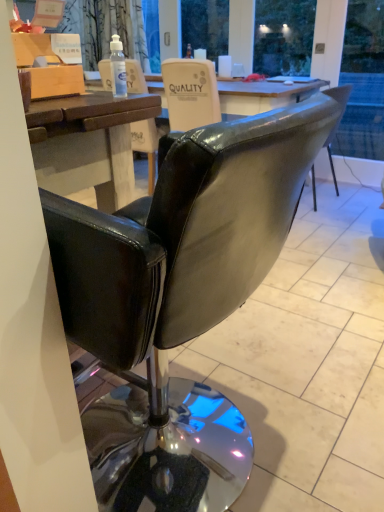
Find the location of a particular element. Image resolution: width=384 pixels, height=512 pixels. black leather chair at center is located at coordinates (179, 301).

Does black leather chair at center turn towards transparent plastic bottle at upper center?

No, black leather chair at center is not oriented towards transparent plastic bottle at upper center.

Can you tell me how much black leather chair at center and transparent plastic bottle at upper center differ in facing direction?

The angle between the facing direction of black leather chair at center and the facing direction of transparent plastic bottle at upper center is 0.00741 degrees.

From the image's perspective, does black leather chair at center appear higher than transparent plastic bottle at upper center?

Incorrect, from the image's perspective, black leather chair at center is lower than transparent plastic bottle at upper center.

Is point (147, 366) positioned after point (119, 65)?

Yes, point (147, 366) is farther from viewer.

Does transparent plastic bottle at upper center turn towards black leather chair at center?

No, transparent plastic bottle at upper center does not turn towards black leather chair at center.

Considering the sizes of objects transparent plastic bottle at upper center and black leather chair at center in the image provided, who is smaller, transparent plastic bottle at upper center or black leather chair at center?

transparent plastic bottle at upper center.

Which object is wider, transparent plastic bottle at upper center or black leather chair at center?

black leather chair at center.

Is point (120, 73) closer to camera compared to point (226, 184)?

No, it is not.

Could you tell me if transparent plastic bottle at upper center is facing wooden box at upper left?

No, transparent plastic bottle at upper center is not oriented towards wooden box at upper left.

Considering the relative positions of transparent plastic bottle at upper center and wooden box at upper left in the image provided, is transparent plastic bottle at upper center behind wooden box at upper left?

Yes, it is behind wooden box at upper left.

From a real-world perspective, between transparent plastic bottle at upper center and wooden box at upper left, who is vertically higher?

In real-world perspective, wooden box at upper left is above.

Based on the photo, would you say transparent plastic bottle at upper center is a long distance from wooden box at upper left?

No, there isn't a large distance between transparent plastic bottle at upper center and wooden box at upper left.

Can wooden box at upper left be found inside black leather chair at center?

No, wooden box at upper left is not inside black leather chair at center.

Is black leather chair at center wider than wooden box at upper left?

Indeed, black leather chair at center has a greater width compared to wooden box at upper left.

Looking at the image, does black leather chair at center seem bigger or smaller compared to wooden box at upper left?

In the image, black leather chair at center appears to be larger than wooden box at upper left.

Is wooden box at upper left not inside black leather chair at center?

Yes, wooden box at upper left is not within black leather chair at center.

Consider the image. Does wooden box at upper left appear on the left side of black leather chair at center?

Yes.

Can you tell me how much wooden box at upper left and black leather chair at center differ in facing direction?

The angular difference between wooden box at upper left and black leather chair at center is 0.001 degrees.

Who is shorter, wooden box at upper left or black leather chair at center?

With less height is wooden box at upper left.

Between wooden box at upper left and transparent plastic bottle at upper center, which one has larger size?

Bigger between the two is wooden box at upper left.

Between wooden box at upper left and transparent plastic bottle at upper center, which one has more height?

wooden box at upper left.

In terms of width, does wooden box at upper left look wider or thinner when compared to transparent plastic bottle at upper center?

Clearly, wooden box at upper left has more width compared to transparent plastic bottle at upper center.

From the image's perspective, between wooden box at upper left and transparent plastic bottle at upper center, which one is located above?

wooden box at upper left.

Locate an element on the screen. This screenshot has height=512, width=384. bottle on the left of black leather chair at center is located at coordinates (118, 67).

The height and width of the screenshot is (512, 384). What are the coordinates of `chair below the transparent plastic bottle at upper center (from a real-world perspective)` in the screenshot? It's located at (179, 301).

Which object lies nearer to the anchor point black leather chair at center, wooden box at upper left or transparent plastic bottle at upper center?

wooden box at upper left is positioned closer to the anchor black leather chair at center.

From the picture: Based on their spatial positions, is black leather chair at center or transparent plastic bottle at upper center further from wooden box at upper left?

black leather chair at center.

Considering their positions, is transparent plastic bottle at upper center positioned further to black leather chair at center than wooden box at upper left?

transparent plastic bottle at upper center is positioned further to the anchor black leather chair at center.

Based on the photo, from the image, which object appears to be farther from transparent plastic bottle at upper center, wooden box at upper left or black leather chair at center?

Among the two, black leather chair at center is located further to transparent plastic bottle at upper center.

Estimate the real-world distances between objects in this image. Which object is closer to transparent plastic bottle at upper center, black leather chair at center or wooden box at upper left?

wooden box at upper left lies closer to transparent plastic bottle at upper center than the other object.

Based on their spatial positions, is transparent plastic bottle at upper center or black leather chair at center closer to wooden box at upper left?

transparent plastic bottle at upper center is closer to wooden box at upper left.

The width and height of the screenshot is (384, 512). I want to click on bottle between wooden box at upper left and black leather chair at center vertically, so click(x=118, y=67).